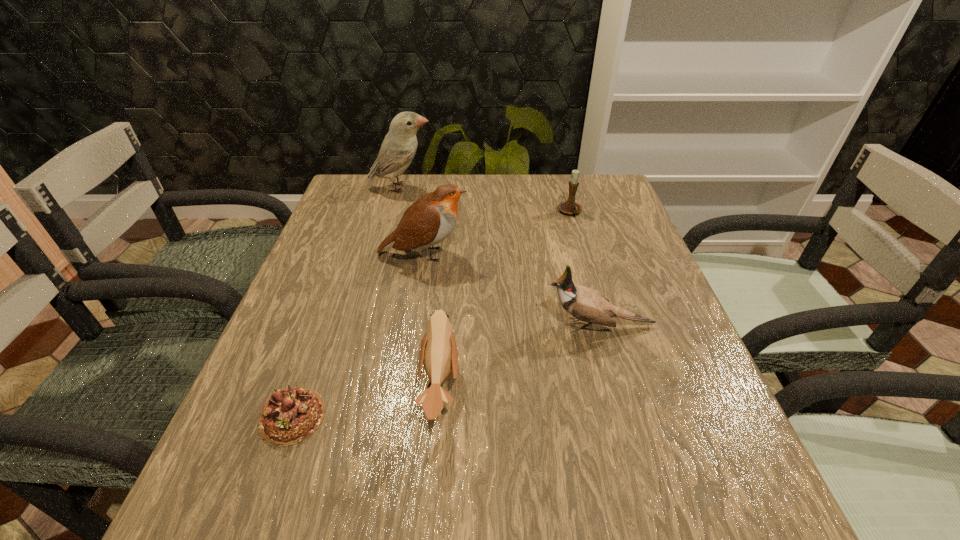
The height and width of the screenshot is (540, 960). I want to click on candle holder at the right edge, so pyautogui.click(x=570, y=207).

Find the location of a particular element. Image resolution: width=960 pixels, height=540 pixels. object at the far left corner is located at coordinates (398, 149).

Identify the location of object situated at the far right corner. (570, 207).

Identify the location of vacant space at the far edge of the desktop. This screenshot has height=540, width=960. (546, 184).

The width and height of the screenshot is (960, 540). In order to click on vacant space at the near edge of the desktop in this screenshot , I will do `click(574, 536)`.

The height and width of the screenshot is (540, 960). I want to click on vacant region at the left edge of the desktop, so click(355, 244).

In the image, there is a desktop. Identify the location of free space at the right edge. (670, 327).

I want to click on free space at the far left corner of the desktop, so click(x=393, y=189).

At what (x,y) coordinates should I click in order to perform the action: click on free space at the far right corner. Please return your answer as a coordinate pair (x, y). This screenshot has width=960, height=540. Looking at the image, I should click on (585, 177).

The image size is (960, 540). What are the coordinates of `blank region between the tallest object and the shortest bird` in the screenshot? It's located at (420, 288).